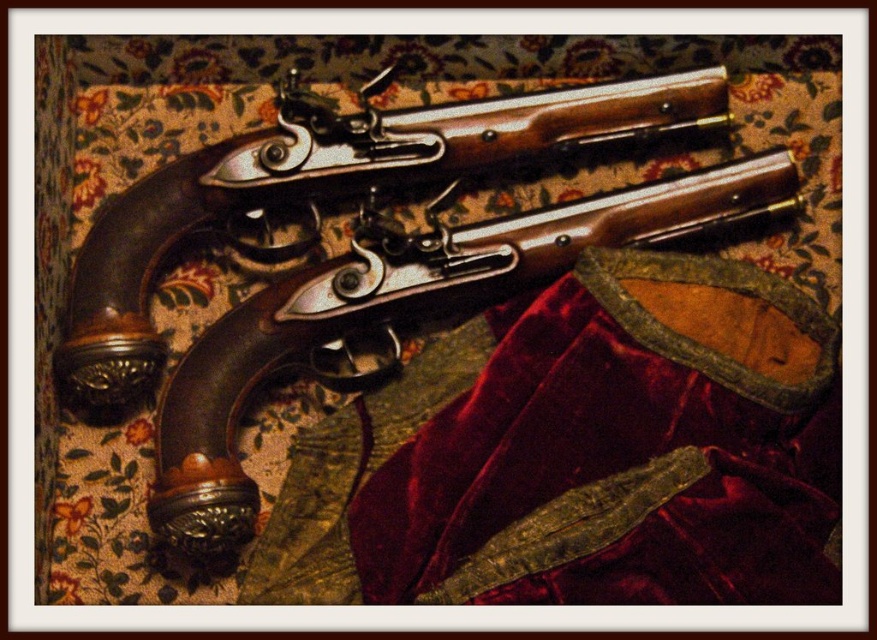
You are an antique collector examining the image. You need to locate the polished wood shotgun at center. What are the coordinates where it is placed?

The polished wood shotgun at center is located at coordinates point (330, 188).

You are standing in front of the antique flintlock pistols displayed on the fabric background. You want to pick up the pistol closest to the point labeled as point (x=137, y=291). Which pistol should you choose?

The point labeled as point (x=137, y=291) is 4.13 feet away from the viewer. Since the question asks for the pistol closest to this point, you should choose the pistol that is positioned nearest to this specific coordinate on the fabric background.

You are an antique collector examining two points on the image of the flintlock pistols. The points are labeled as point (229,173) and point (362,228). Which point is closer to you?

Point (229,173) is further to the camera than point (362,228), so point (362,228) is closer to you.